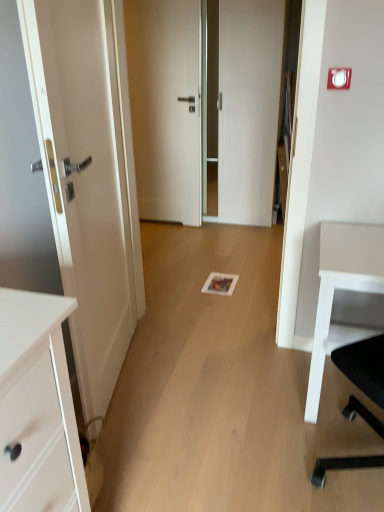
Describe the element at coordinates (165, 106) in the screenshot. I see `white matte door at center, the third door when ordered from front to back` at that location.

What is the approximate height of white matte door at center, the third door when ordered from front to back?

The height of white matte door at center, the third door when ordered from front to back, is 1.85 meters.

What is the approximate height of white matte desk at right?

29.46 inches.

At what (x,y) coordinates should I click in order to perform the action: click on white glossy door at left, positioned as the 1th door in front-to-back order. Please return your answer as a coordinate pair (x, y). Looking at the image, I should click on (88, 179).

What do you see at coordinates (88, 179) in the screenshot? I see `white glossy door at left, the 3th door from the back` at bounding box center [88, 179].

I want to click on white glossy door at center, placed as the 2th door when sorted from front to back, so click(248, 108).

Relative to white matte door at center, the third door when ordered from front to back, is white glossy door at left, the 3th door from the back, in front or behind?

Visually, white glossy door at left, the 3th door from the back, is located in front of white matte door at center, the third door when ordered from front to back.

Which is correct: white glossy door at left, positioned as the 1th door in front-to-back order, is inside white matte door at center, the first door in the back-to-front sequence, or outside of it?

white glossy door at left, positioned as the 1th door in front-to-back order, is not inside white matte door at center, the first door in the back-to-front sequence, it's outside.

Is white glossy door at left, positioned as the 1th door in front-to-back order, facing away from white matte door at center, the first door in the back-to-front sequence?

white glossy door at left, positioned as the 1th door in front-to-back order, is not turned away from white matte door at center, the first door in the back-to-front sequence.

Between white glossy door at left, positioned as the 1th door in front-to-back order, and white matte door at center, the first door in the back-to-front sequence, which one has smaller size?

white matte door at center, the first door in the back-to-front sequence, is smaller.

In terms of height, does white matte desk at right look taller or shorter compared to white glossy door at left, the 3th door from the back?

Considering their sizes, white matte desk at right has less height than white glossy door at left, the 3th door from the back.

Can you confirm if white matte desk at right is smaller than white glossy door at left, the 3th door from the back?

Indeed, white matte desk at right has a smaller size compared to white glossy door at left, the 3th door from the back.

Is white matte desk at right facing away from white glossy door at left, the 3th door from the back?

No, white glossy door at left, the 3th door from the back, is not at the back of white matte desk at right.

From the picture: Based on their positions, is white matte door at center, the first door in the back-to-front sequence, located to the left or right of white matte desk at right?

white matte door at center, the first door in the back-to-front sequence, is to the left of white matte desk at right.

Is white matte door at center, the first door in the back-to-front sequence, shorter than white matte desk at right?

No, white matte door at center, the first door in the back-to-front sequence, is not shorter than white matte desk at right.

Can you tell me how much white matte door at center, the first door in the back-to-front sequence, and white matte desk at right differ in facing direction?

The facing directions of white matte door at center, the first door in the back-to-front sequence, and white matte desk at right are 0.483 degrees apart.

From the picture: From a real-world perspective, does white glossy door at left, the 3th door from the back, sit lower than white glossy door at center, marked as the second door in a back-to-front arrangement?

Yes, from a real-world perspective, white glossy door at left, the 3th door from the back, is under white glossy door at center, marked as the second door in a back-to-front arrangement.

Which of these two, white glossy door at left, positioned as the 1th door in front-to-back order, or white glossy door at center, marked as the second door in a back-to-front arrangement, is thinner?

Thinner between the two is white glossy door at left, positioned as the 1th door in front-to-back order.

Does white glossy door at left, the 3th door from the back, have a lesser height compared to white glossy door at center, placed as the 2th door when sorted from front to back?

Yes, white glossy door at left, the 3th door from the back, is shorter than white glossy door at center, placed as the 2th door when sorted from front to back.

Is white glossy door at left, the 3th door from the back, placed right next to white glossy door at center, marked as the second door in a back-to-front arrangement?

There is a gap between white glossy door at left, the 3th door from the back, and white glossy door at center, marked as the second door in a back-to-front arrangement.

Based on their positions, is white glossy door at left, positioned as the 1th door in front-to-back order, located to the left or right of white matte desk at right?

In the image, white glossy door at left, positioned as the 1th door in front-to-back order, appears on the left side of white matte desk at right.

Locate an element on the screen. The image size is (384, 512). desk behind the white glossy door at left, the 3th door from the back is located at coordinates (342, 286).

Based on their sizes in the image, would you say white glossy door at left, the 3th door from the back, is bigger or smaller than white matte desk at right?

In the image, white glossy door at left, the 3th door from the back, appears to be larger than white matte desk at right.

From the image's perspective, is white glossy door at left, positioned as the 1th door in front-to-back order, below white matte desk at right?

No, from the image's perspective, white glossy door at left, positioned as the 1th door in front-to-back order, is not below white matte desk at right.

Which of these two, white glossy door at center, marked as the second door in a back-to-front arrangement, or white matte door at center, the first door in the back-to-front sequence, stands taller?

white glossy door at center, marked as the second door in a back-to-front arrangement.

Is white glossy door at center, placed as the 2th door when sorted from front to back, outside of white matte door at center, the first door in the back-to-front sequence?

Yes, white glossy door at center, placed as the 2th door when sorted from front to back, is outside of white matte door at center, the first door in the back-to-front sequence.

Where is `the 1st door to the left of the white glossy door at center, marked as the second door in a back-to-front arrangement, starting your count from the anchor`? Image resolution: width=384 pixels, height=512 pixels. the 1st door to the left of the white glossy door at center, marked as the second door in a back-to-front arrangement, starting your count from the anchor is located at coordinates (165, 106).

Is white glossy door at center, placed as the 2th door when sorted from front to back, positioned with its back to white matte door at center, the third door when ordered from front to back?

No, white glossy door at center, placed as the 2th door when sorted from front to back, is not facing the opposite direction of white matte door at center, the third door when ordered from front to back.

From the image's perspective, which one is positioned lower, white matte desk at right or white matte door at center, the third door when ordered from front to back?

white matte desk at right.

How far apart are white matte desk at right and white matte door at center, the third door when ordered from front to back?

The distance of white matte desk at right from white matte door at center, the third door when ordered from front to back, is 7.25 feet.

From a real-world perspective, between white matte desk at right and white matte door at center, the third door when ordered from front to back, who is vertically higher?

In real-world perspective, white matte door at center, the third door when ordered from front to back, is above.

Does white matte desk at right have a larger size compared to white matte door at center, the third door when ordered from front to back?

Correct, white matte desk at right is larger in size than white matte door at center, the third door when ordered from front to back.

Where is `door below the white matte door at center, the first door in the back-to-front sequence (from the image's perspective)`? This screenshot has height=512, width=384. door below the white matte door at center, the first door in the back-to-front sequence (from the image's perspective) is located at coordinates (88, 179).

Where is `door located in front of the white matte desk at right`? This screenshot has height=512, width=384. door located in front of the white matte desk at right is located at coordinates (88, 179).

When comparing their distances from white glossy door at left, positioned as the 1th door in front-to-back order, does white glossy door at center, placed as the 2th door when sorted from front to back, or white matte desk at right seem closer?

white matte desk at right is positioned closer to the anchor white glossy door at left, positioned as the 1th door in front-to-back order.

From the image, which object appears to be farther from white glossy door at center, placed as the 2th door when sorted from front to back, white matte door at center, the first door in the back-to-front sequence, or white matte desk at right?

Based on the image, white matte desk at right appears to be further to white glossy door at center, placed as the 2th door when sorted from front to back.

Which object lies nearer to the anchor point white matte door at center, the third door when ordered from front to back, white matte desk at right or white glossy door at left, positioned as the 1th door in front-to-back order?

The object closer to white matte door at center, the third door when ordered from front to back, is white glossy door at left, positioned as the 1th door in front-to-back order.

When comparing their distances from white matte desk at right, does white glossy door at center, marked as the second door in a back-to-front arrangement, or white glossy door at left, positioned as the 1th door in front-to-back order, seem closer?

The object closer to white matte desk at right is white glossy door at left, positioned as the 1th door in front-to-back order.

When comparing their distances from white matte door at center, the first door in the back-to-front sequence, does white glossy door at left, positioned as the 1th door in front-to-back order, or white matte desk at right seem closer?

white glossy door at left, positioned as the 1th door in front-to-back order, lies closer to white matte door at center, the first door in the back-to-front sequence, than the other object.

Which object lies further to the anchor point white glossy door at left, positioned as the 1th door in front-to-back order, white matte door at center, the first door in the back-to-front sequence, or white matte desk at right?

Based on the image, white matte door at center, the first door in the back-to-front sequence, appears to be further to white glossy door at left, positioned as the 1th door in front-to-back order.

Looking at the image, which one is located further to white matte desk at right, white matte door at center, the first door in the back-to-front sequence, or white glossy door at center, placed as the 2th door when sorted from front to back?

Among the two, white matte door at center, the first door in the back-to-front sequence, is located further to white matte desk at right.

Looking at the image, which one is located further to white glossy door at center, marked as the second door in a back-to-front arrangement, white glossy door at left, positioned as the 1th door in front-to-back order, or white matte door at center, the third door when ordered from front to back?

The object further to white glossy door at center, marked as the second door in a back-to-front arrangement, is white glossy door at left, positioned as the 1th door in front-to-back order.

The height and width of the screenshot is (512, 384). Identify the location of door between white glossy door at left, positioned as the 1th door in front-to-back order, and white matte door at center, the third door when ordered from front to back, along the z-axis. (248, 108).

Identify the location of desk between white glossy door at left, positioned as the 1th door in front-to-back order, and white glossy door at center, placed as the 2th door when sorted from front to back, from front to back. The image size is (384, 512). (342, 286).

Locate an element on the screen. door positioned between white matte desk at right and white matte door at center, the first door in the back-to-front sequence, from near to far is located at coordinates (248, 108).

The image size is (384, 512). I want to click on desk positioned between white glossy door at left, the 3th door from the back, and white matte door at center, the first door in the back-to-front sequence, from near to far, so click(342, 286).